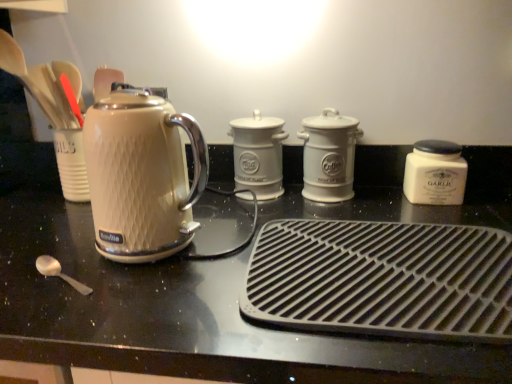
Identify the location of vacant space situated above matte white kettle at left (from a real-world perspective). This screenshot has width=512, height=384. (257, 256).